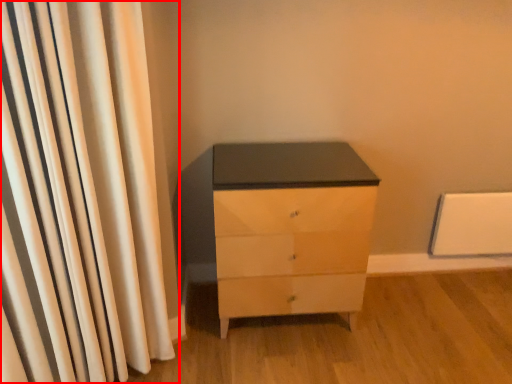
Question: From the image's perspective, considering the relative positions of curtain (annotated by the red box) and chest of drawers in the image provided, where is curtain (annotated by the red box) located with respect to the staircase?

Choices:
 (A) below
 (B) above

Answer: (B)